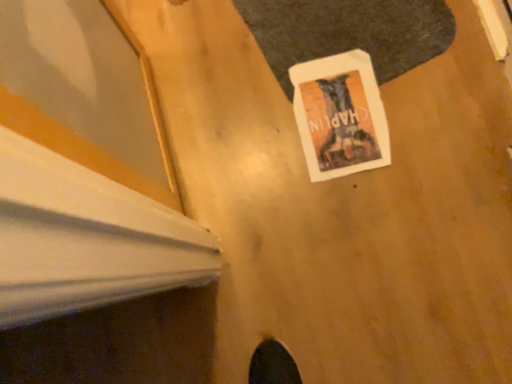
Where is `vacant space situated above white paper at center (from a real-world perspective)`? The image size is (512, 384). vacant space situated above white paper at center (from a real-world perspective) is located at coordinates (344, 112).